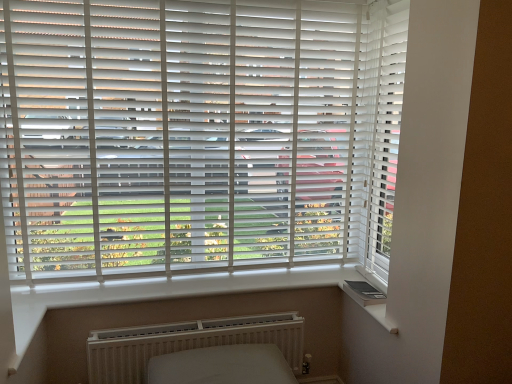
Identify the location of vacant space in white matte blinds at center (from a real-world perspective). This screenshot has width=512, height=384. point(182,277).